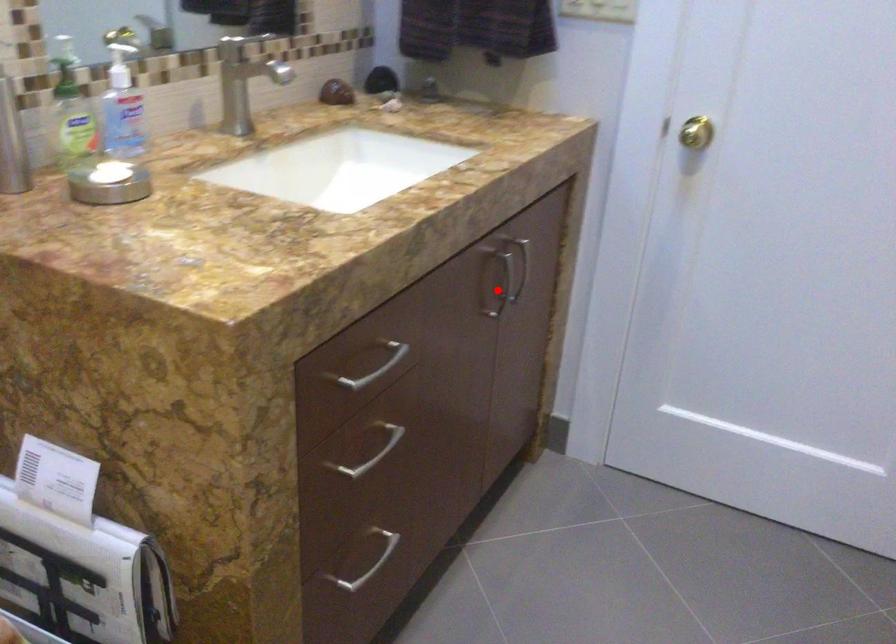
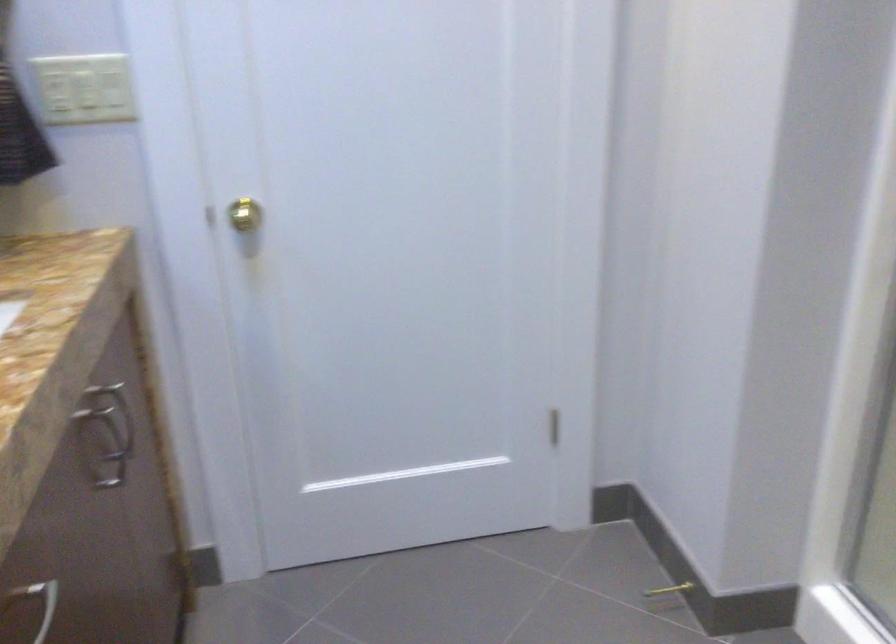
In the second image, find the point that corresponds to the highlighted location in the first image.

(113, 453)